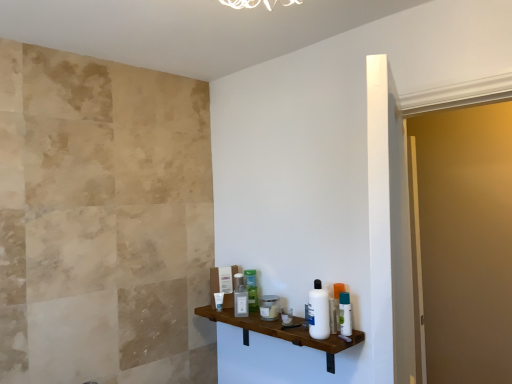
Question: Considering their positions, is white plastic bottle at right, the 7th toiletry positioned from the left, located in front of or behind white plastic bottle at shelf, which appears as the seventh toiletry when viewed from the back?

Choices:
 (A) behind
 (B) front

Answer: (A)

Question: Considering the relative positions of white plastic bottle at right, the 7th toiletry positioned from the left, and white plastic bottle at shelf, the 6th toiletry when ordered from left to right, in the image provided, is white plastic bottle at right, the 7th toiletry positioned from the left, to the left or to the right of white plastic bottle at shelf, the 6th toiletry when ordered from left to right,?

Choices:
 (A) left
 (B) right

Answer: (B)

Question: Which is nearer to the matte glass jar at center, positioned as the fourth toiletry in right-to-left order?

Choices:
 (A) brown wooden shelf at center
 (B) white glossy tube at center, which is the 7th toiletry in front-to-back order
 (C) green plastic bottle at center, acting as the second toiletry starting from the back
 (D) clear plastic cup at center, positioned as the 5th toiletry in left-to-right order
 (E) white plastic bottle at shelf, the second toiletry in the right-to-left sequence

Answer: (D)

Question: Which object is positioned closest to the white glossy tube at center, the seventh toiletry positioned from the right?

Choices:
 (A) brown wooden shelf at center
 (B) clear plastic cup at center, positioned as the 5th toiletry in left-to-right order
 (C) white plastic bottle at right, the 2th toiletry in the front-to-back sequence
 (D) white glossy lotion at center, the 3th toiletry in the back-to-front sequence
 (E) green plastic bottle at center, acting as the second toiletry starting from the back

Answer: (D)